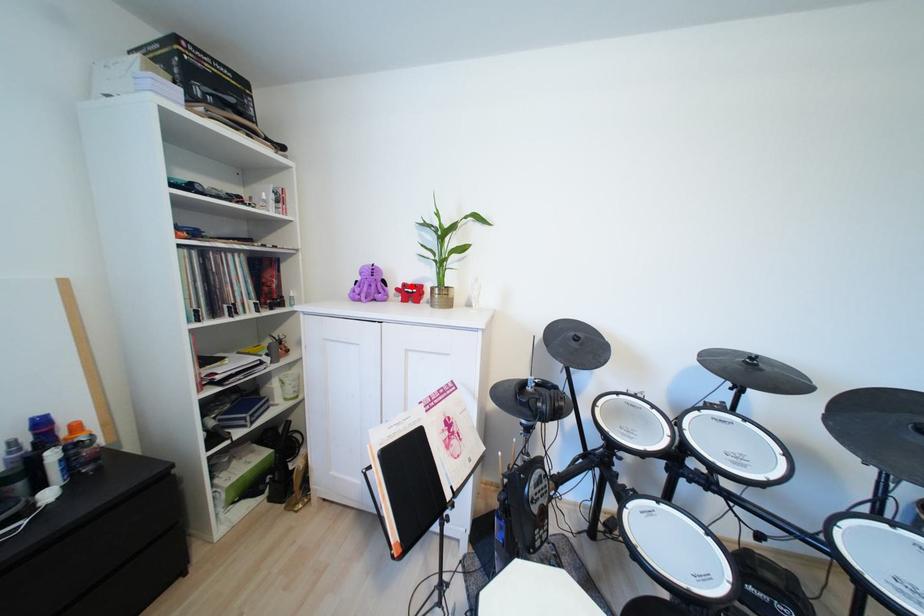
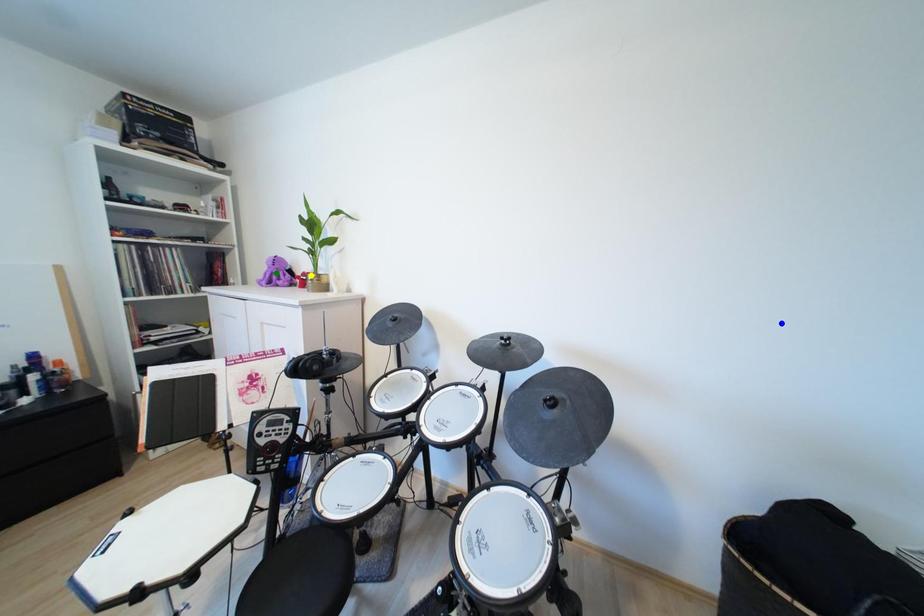
Question: I am providing you with two images of the same scene from different viewpoints. A red point is marked on the first image. You are given multiple points on the second image. Which spot in image 2 lines up with the point in image 1?

Choices:
 (A) blue point
 (B) yellow point
 (C) green point

Answer: (B)